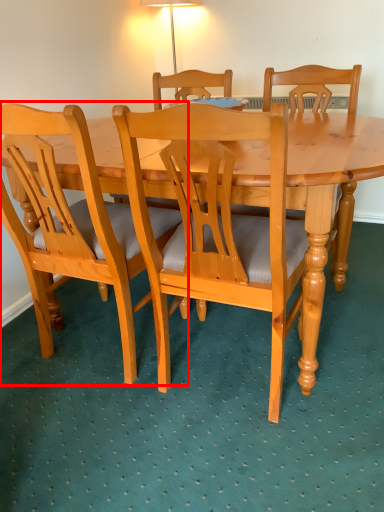
Question: In this image, where is chair (annotated by the red box) located relative to chair?

Choices:
 (A) left
 (B) right

Answer: (A)